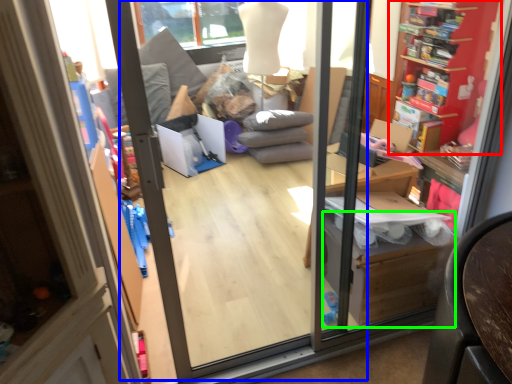
Question: Based on their relative distances, which object is farther from shelf (highlighted by a red box)? Choose from screen door (highlighted by a blue box) and cardboard box (highlighted by a green box).

Choices:
 (A) screen door
 (B) cardboard box

Answer: (A)